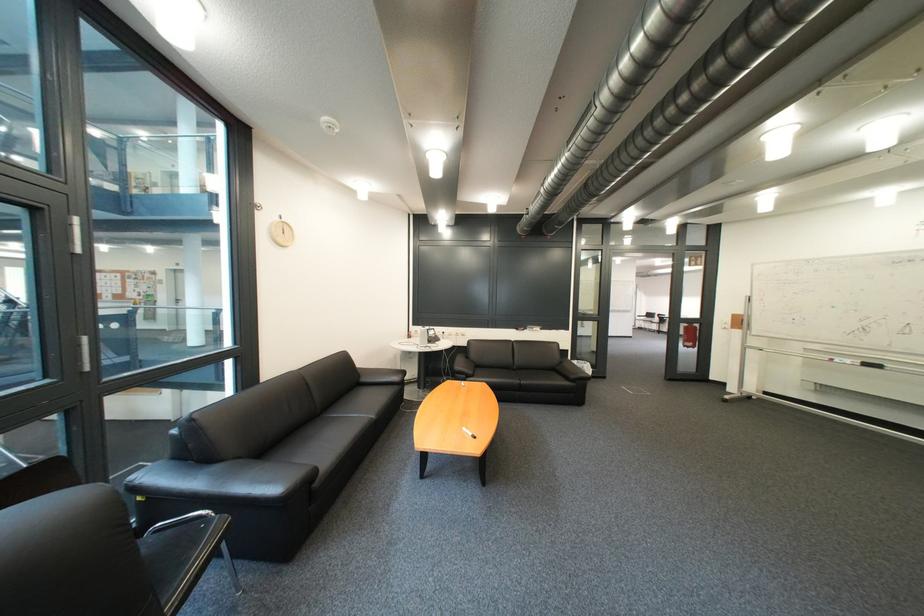
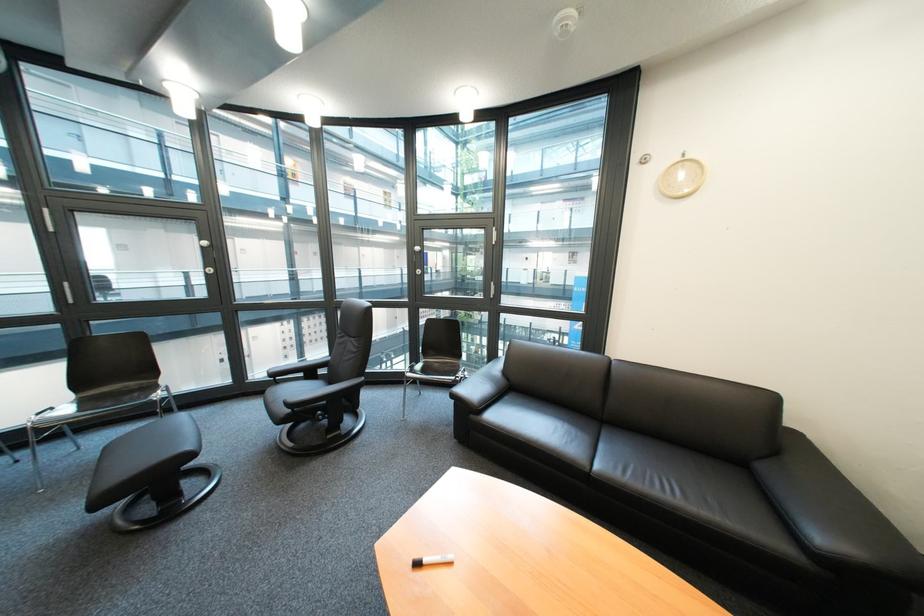
Locate, in the second image, the point that corresponds to (x=408, y=381) in the first image.

(833, 540)